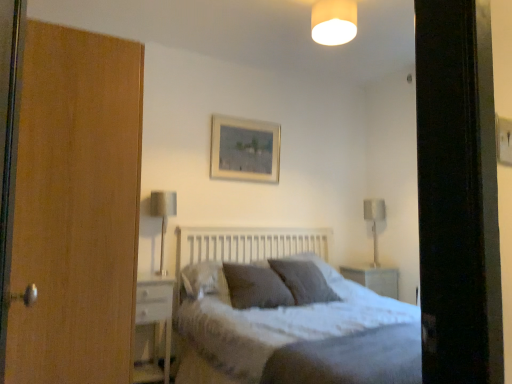
What do you see at coordinates (163, 217) in the screenshot? This screenshot has width=512, height=384. I see `satin silver table lamp at left, the first table lamp positioned from the left` at bounding box center [163, 217].

Measure the distance between point (355,24) and camera.

The distance of point (355,24) from camera is 2.38 meters.

Describe the element at coordinates (334, 21) in the screenshot. I see `matte white lampshade at upper center` at that location.

The image size is (512, 384). Identify the location of textured gray bed at center. (272, 329).

Describe the element at coordinates (318, 265) in the screenshot. I see `dark gray textured pillow at center, the first pillow from the back` at that location.

Measure the distance between point (x=375, y=255) and camera.

Point (x=375, y=255) and camera are 13.20 feet apart.

Locate an element on the screen. white glossy nightstand at lower left is located at coordinates (154, 321).

In order to click on satin silver table lamp at left, the 2th table lamp positioned from the right in this screenshot , I will do `click(163, 217)`.

Is dark gray textured pillow at center, the first pillow from the back, completely or partially outside of white glossy nightstand at lower left?

That's correct, dark gray textured pillow at center, the first pillow from the back, is outside of white glossy nightstand at lower left.

Considering the relative sizes of dark gray textured pillow at center, which appears as the third pillow when viewed from the front, and white glossy nightstand at lower left in the image provided, is dark gray textured pillow at center, which appears as the third pillow when viewed from the front, shorter than white glossy nightstand at lower left?

Indeed, dark gray textured pillow at center, which appears as the third pillow when viewed from the front, has a lesser height compared to white glossy nightstand at lower left.

Which is farther from the camera, (332,279) or (140,287)?

The point (332,279) is more distant.

Who is bigger, dark gray textured pillow at center, the first pillow from the back, or white glossy nightstand at lower left?

With larger size is white glossy nightstand at lower left.

Locate an element on the screen. table lamp above the metallic silver table lamp at right, which ranks as the second table lamp in left-to-right order (from the image's perspective) is located at coordinates (163, 217).

Is the position of satin silver table lamp at left, which is the 1th table lamp from front to back, less distant than that of metallic silver table lamp at right, which ranks as the second table lamp in front-to-back order?

Yes, it is.

Is satin silver table lamp at left, acting as the second table lamp starting from the back, oriented away from metallic silver table lamp at right, which ranks as the second table lamp in left-to-right order?

No, satin silver table lamp at left, acting as the second table lamp starting from the back,'s orientation is not away from metallic silver table lamp at right, which ranks as the second table lamp in left-to-right order.

Can you confirm if metallic silver table lamp at right, which ranks as the second table lamp in front-to-back order, is shorter than matte white lampshade at upper center?

No, metallic silver table lamp at right, which ranks as the second table lamp in front-to-back order, is not shorter than matte white lampshade at upper center.

Can you confirm if metallic silver table lamp at right, the first table lamp positioned from the back, is wider than matte white lampshade at upper center?

No.

Where is `light fixture on the left of metallic silver table lamp at right, which ranks as the second table lamp in front-to-back order`? This screenshot has height=384, width=512. light fixture on the left of metallic silver table lamp at right, which ranks as the second table lamp in front-to-back order is located at coordinates (334, 21).

Considering the relative positions of metallic silver table lamp at right, which ranks as the second table lamp in front-to-back order, and matte white lampshade at upper center in the image provided, is metallic silver table lamp at right, which ranks as the second table lamp in front-to-back order, to the right of matte white lampshade at upper center from the viewer's perspective?

Yes.

Is textured gray pillow at center, which is the 2th pillow in front-to-back order, oriented towards textured gray pillow at center, the third pillow when ordered from back to front?

No, textured gray pillow at center, which is the 2th pillow in front-to-back order, is not turned towards textured gray pillow at center, the third pillow when ordered from back to front.

What's the angular difference between textured gray pillow at center, which is the 2th pillow in front-to-back order, and textured gray pillow at center, the third pillow when ordered from back to front,'s facing directions?

They differ by 19.7 degrees in their facing directions.

Is textured gray pillow at center, the second pillow viewed from the back, next to textured gray pillow at center, placed as the 1th pillow when sorted from front to back, and touching it?

No.

Which is behind, point (300, 275) or point (268, 282)?

The point (300, 275) is farther.

Based on the photo, is white glossy nightstand at lower left positioned far away from dark gray textured pillow at center, the first pillow from the back?

Indeed, white glossy nightstand at lower left is not near dark gray textured pillow at center, the first pillow from the back.

Looking at the image, does white glossy nightstand at lower left seem bigger or smaller compared to dark gray textured pillow at center, the first pillow from the back?

Clearly, white glossy nightstand at lower left is larger in size than dark gray textured pillow at center, the first pillow from the back.

Considering the sizes of white glossy nightstand at lower left and dark gray textured pillow at center, the first pillow from the back, in the image, is white glossy nightstand at lower left taller or shorter than dark gray textured pillow at center, the first pillow from the back,?

In the image, white glossy nightstand at lower left appears to be taller than dark gray textured pillow at center, the first pillow from the back.

Is white glossy nightstand at lower left situated inside dark gray textured pillow at center, the first pillow from the back, or outside?

The correct answer is: outside.

Considering the relative positions of matte white lampshade at upper center and satin silver table lamp at left, acting as the second table lamp starting from the back, in the image provided, is matte white lampshade at upper center behind satin silver table lamp at left, acting as the second table lamp starting from the back,?

That is False.

Is matte white lampshade at upper center taller than satin silver table lamp at left, acting as the second table lamp starting from the back?

No, matte white lampshade at upper center is not taller than satin silver table lamp at left, acting as the second table lamp starting from the back.

Considering the sizes of objects matte white lampshade at upper center and satin silver table lamp at left, which is the 1th table lamp from front to back, in the image provided, who is wider, matte white lampshade at upper center or satin silver table lamp at left, which is the 1th table lamp from front to back,?

With larger width is matte white lampshade at upper center.

Measure the distance between matte white lampshade at upper center and satin silver table lamp at left, acting as the second table lamp starting from the back.

matte white lampshade at upper center is 1.64 meters from satin silver table lamp at left, acting as the second table lamp starting from the back.

Would you say textured gray bed at center is to the left or to the right of white glossy nightstand at lower left in the picture?

Clearly, textured gray bed at center is on the right of white glossy nightstand at lower left in the image.

Can you confirm if textured gray bed at center is wider than white glossy nightstand at lower left?

Yes.

From the image's perspective, between textured gray bed at center and white glossy nightstand at lower left, who is located below?

white glossy nightstand at lower left.

The width and height of the screenshot is (512, 384). What are the coordinates of `nightstand in front of the dark gray textured pillow at center, the first pillow from the back` in the screenshot? It's located at (154, 321).

You are a GUI agent. You are given a task and a screenshot of the screen. Output one action in this format:
    pyautogui.click(x=<x>, y=<y>)
    Task: Click on the table lamp on the left of metallic silver table lamp at right, which is the 1th table lamp in right-to-left order
    The height and width of the screenshot is (384, 512).
    Given the screenshot: What is the action you would take?
    pyautogui.click(x=163, y=217)

Which object lies further to the anchor point wooden picture frame at upper center, dark gray textured pillow at center, which appears as the third pillow when viewed from the front, or textured gray pillow at center, the third pillow when ordered from back to front?

textured gray pillow at center, the third pillow when ordered from back to front, is further to wooden picture frame at upper center.

Considering their positions, is wooden picture frame at upper center positioned further to satin silver table lamp at left, the 2th table lamp positioned from the right, than dark gray textured pillow at center, which appears as the third pillow when viewed from the front?

dark gray textured pillow at center, which appears as the third pillow when viewed from the front, is positioned further to the anchor satin silver table lamp at left, the 2th table lamp positioned from the right.

Which object lies nearer to the anchor point wooden picture frame at upper center, matte white lampshade at upper center or textured gray pillow at center, which is the 2th pillow in front-to-back order?

The object closer to wooden picture frame at upper center is textured gray pillow at center, which is the 2th pillow in front-to-back order.

Based on their spatial positions, is wooden picture frame at upper center or white glossy nightstand at lower left closer to matte white lampshade at upper center?

Among the two, wooden picture frame at upper center is located nearer to matte white lampshade at upper center.

Considering their positions, is dark gray textured pillow at center, which appears as the third pillow when viewed from the front, positioned further to textured gray pillow at center, the third pillow when ordered from back to front, than satin silver table lamp at left, which is the 1th table lamp from front to back?

satin silver table lamp at left, which is the 1th table lamp from front to back, is further to textured gray pillow at center, the third pillow when ordered from back to front.

When comparing their distances from textured gray pillow at center, the second pillow viewed from the back, does textured gray pillow at center, the third pillow when ordered from back to front, or metallic silver table lamp at right, which ranks as the second table lamp in left-to-right order, seem further?

Based on the image, metallic silver table lamp at right, which ranks as the second table lamp in left-to-right order, appears to be further to textured gray pillow at center, the second pillow viewed from the back.

From the image, which object appears to be nearer to wooden picture frame at upper center, dark gray textured pillow at center, the first pillow from the back, or textured gray pillow at center, the second pillow viewed from the back?

dark gray textured pillow at center, the first pillow from the back.

Consider the image. When comparing their distances from textured gray pillow at center, the second pillow viewed from the back, does textured gray bed at center or white glossy nightstand at lower left seem further?

The object further to textured gray pillow at center, the second pillow viewed from the back, is white glossy nightstand at lower left.

The image size is (512, 384). I want to click on pillow situated between textured gray pillow at center, placed as the 1th pillow when sorted from front to back, and textured gray pillow at center, which is the 2th pillow in front-to-back order, from left to right, so click(x=318, y=265).

Find the location of a particular element. table lamp between textured gray bed at center and wooden picture frame at upper center from front to back is located at coordinates (163, 217).

Identify the location of picture frame between matte white lampshade at upper center and textured gray pillow at center, which is the 2th pillow in front-to-back order, from top to bottom. (244, 150).

Identify the location of bed that lies between matte white lampshade at upper center and white glossy nightstand at lower left from top to bottom. This screenshot has width=512, height=384. (272, 329).